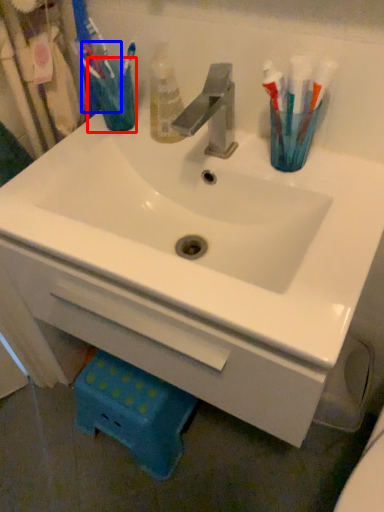
Question: Which of the following is the closest to the observer, turquoise (highlighted by a red box) or toothbrush (highlighted by a blue box)?

Choices:
 (A) turquoise
 (B) toothbrush

Answer: (B)